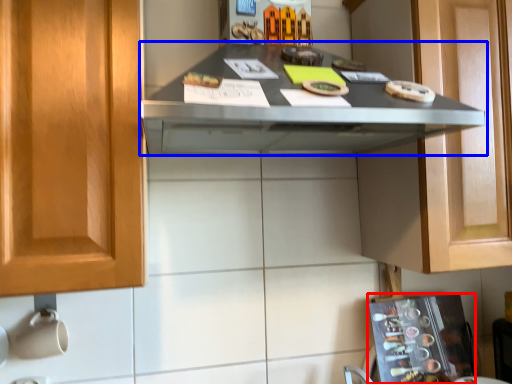
Question: Among these objects, which one is farthest to the camera, appliance (highlighted by a red box) or countertop (highlighted by a blue box)?

Choices:
 (A) appliance
 (B) countertop

Answer: (A)